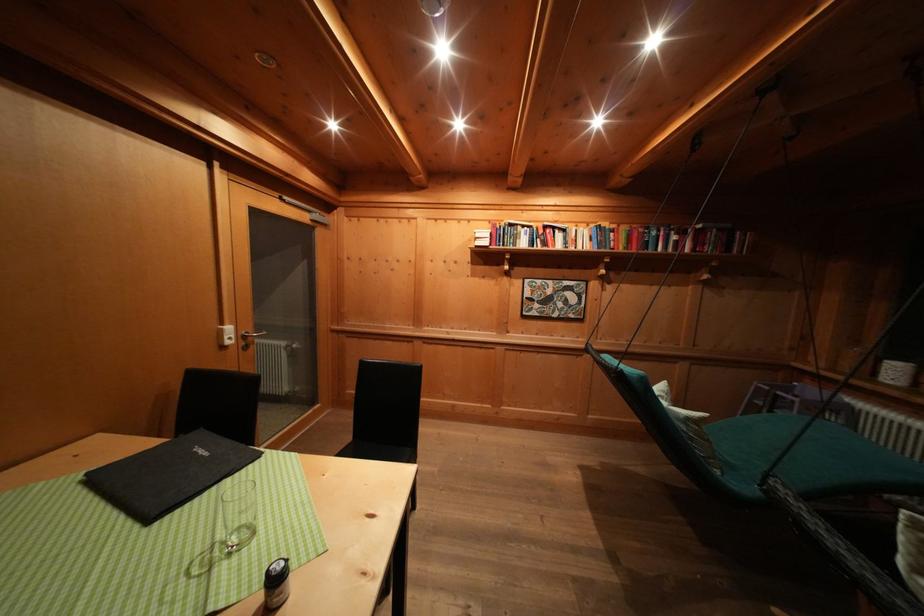
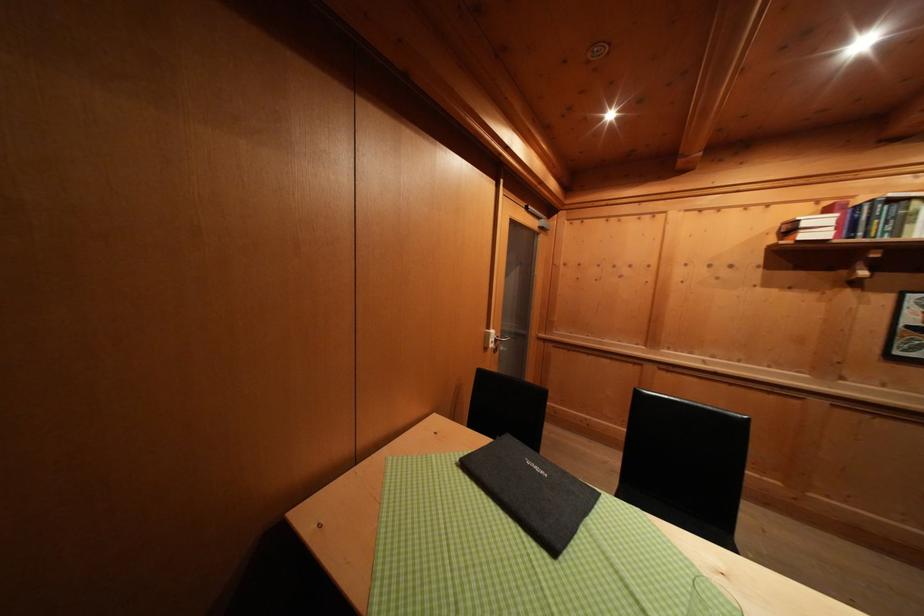
Question: How did the camera likely rotate?

Choices:
 (A) Left
 (B) Right
 (C) Up
 (D) Down

Answer: (A)